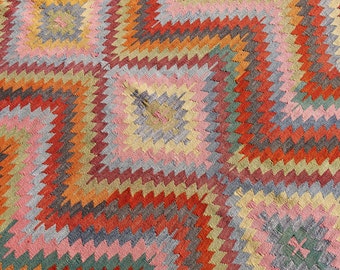
Image resolution: width=340 pixels, height=270 pixels. I want to click on wrinkle in rug or blanket, so click(x=145, y=93), click(x=153, y=103).